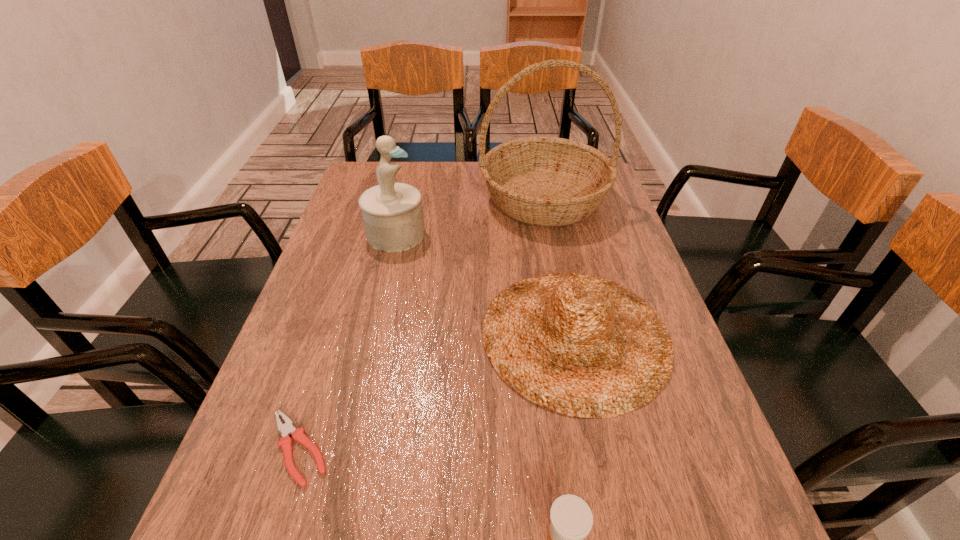
Locate an element on the screen. The image size is (960, 540). pliers situated at the left edge is located at coordinates click(x=286, y=429).

What are the coordinates of `basket that is at the right edge` in the screenshot? It's located at (545, 181).

The image size is (960, 540). In order to click on sunhat that is at the right edge in this screenshot , I will do `click(584, 346)`.

You are a GUI agent. You are given a task and a screenshot of the screen. Output one action in this format:
    pyautogui.click(x=<x>, y=<y>)
    Task: Click on the object that is at the far right corner
    The height and width of the screenshot is (540, 960).
    Given the screenshot: What is the action you would take?
    pyautogui.click(x=545, y=181)

In the image, there is a desktop. Where is `vacant space at the far edge`? vacant space at the far edge is located at coordinates (486, 195).

The height and width of the screenshot is (540, 960). In the image, there is a desktop. In order to click on blank space at the left edge in this screenshot , I will do `click(337, 291)`.

The image size is (960, 540). In the image, there is a desktop. Identify the location of vacant space at the right edge. (663, 473).

The width and height of the screenshot is (960, 540). I want to click on free location at the far left corner, so click(354, 184).

At what (x,y) coordinates should I click in order to perform the action: click on free area in between the pliers and the basket. Please return your answer as a coordinate pair (x, y). The width and height of the screenshot is (960, 540). Looking at the image, I should click on (421, 323).

This screenshot has height=540, width=960. Identify the location of vacant area that lies between the pliers and the figurine. (348, 341).